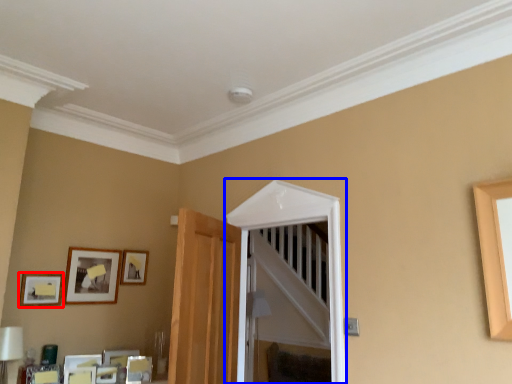
Question: Which of the following is the farthest to the observer, picture frame (highlighted by a red box) or glass door (highlighted by a blue box)?

Choices:
 (A) picture frame
 (B) glass door

Answer: (A)